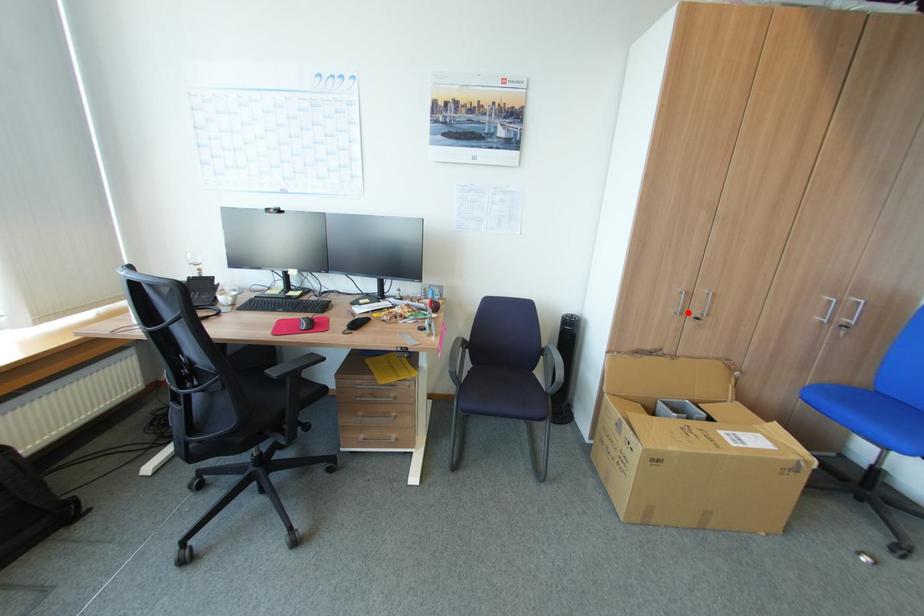
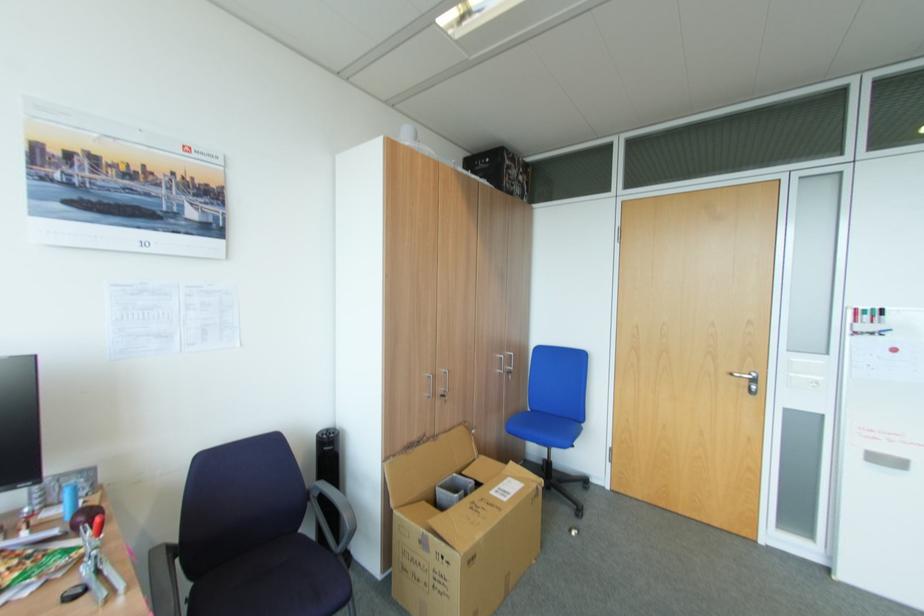
Question: I am providing you with two images of the same scene from different viewpoints. In image1, a red point is highlighted. Considering the same 3D point in image2, which of the following is correct?

Choices:
 (A) It is closer
 (B) It is farther

Answer: (B)